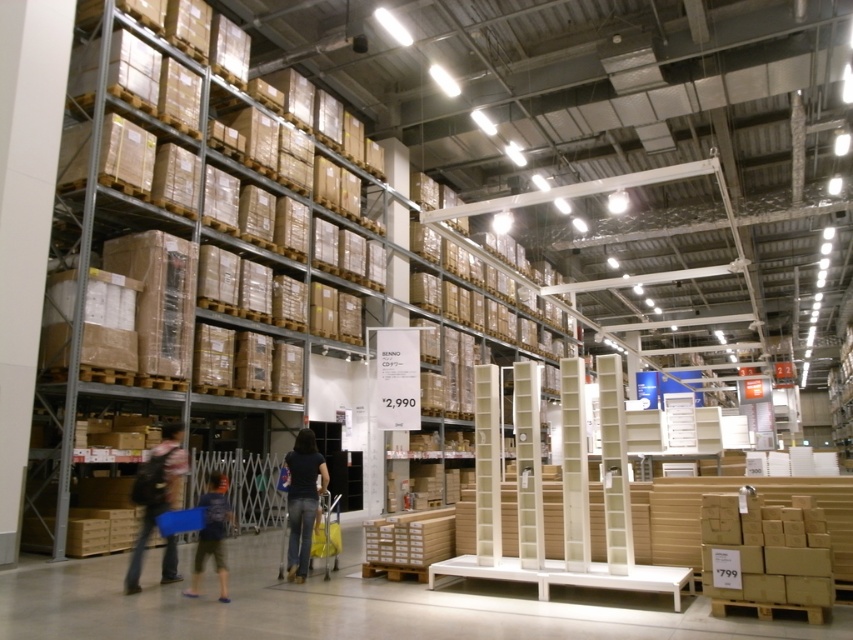
Question: Is denim jacket at lower left wider than dark blue shirt at center?

Choices:
 (A) yes
 (B) no

Answer: (A)

Question: Based on their relative distances, which object is farther from the dark blue shirt at center?

Choices:
 (A) denim jacket at lower left
 (B) dark blue jeans at lower left

Answer: (A)

Question: Among these points, which one is farthest from the camera?

Choices:
 (A) (222, 600)
 (B) (164, 552)

Answer: (B)

Question: Does denim jacket at lower left have a larger size compared to dark blue shirt at center?

Choices:
 (A) yes
 (B) no

Answer: (A)

Question: Which of these objects is positioned farthest from the dark blue shirt at center?

Choices:
 (A) denim jacket at lower left
 (B) dark blue jeans at lower left

Answer: (A)

Question: Does denim jacket at lower left come in front of dark blue shirt at center?

Choices:
 (A) yes
 (B) no

Answer: (A)